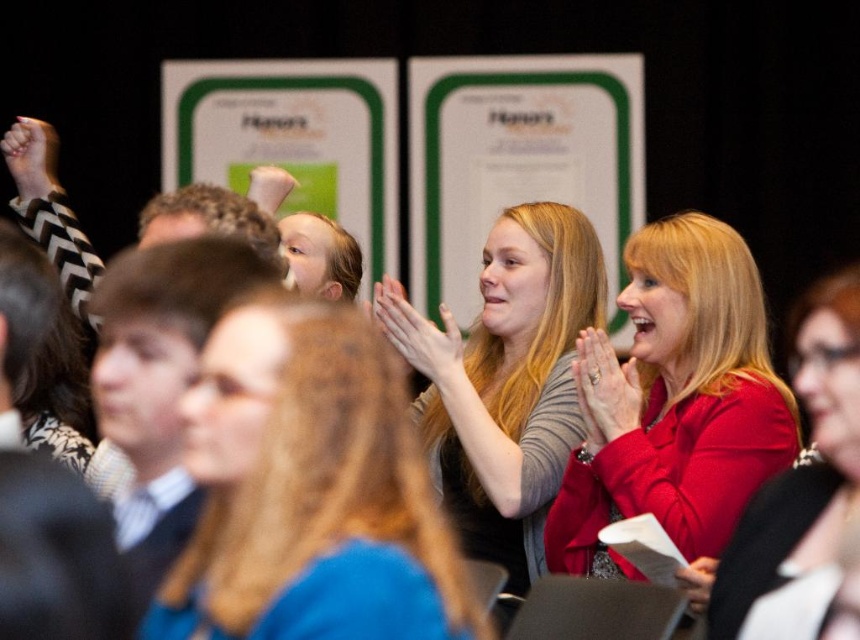
You are an event planner setting up a photo backdrop. You need to ensure that the matte black fist at upper left and the matte white hand at upper center are arranged in a way that the fist is positioned above the hand. Based on the scene description, are they currently arranged correctly?

Yes, the matte black fist at upper left is located above the matte white hand at upper center, so they are arranged correctly as required.